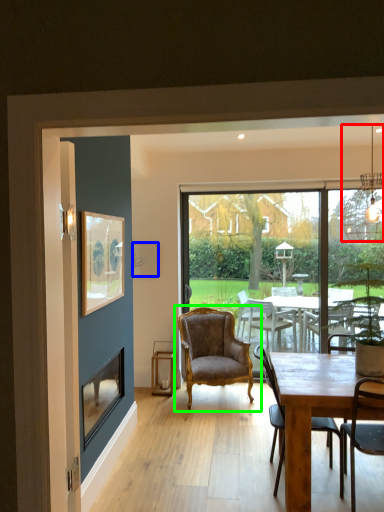
Question: Based on their relative distances, which object is farther from lamp (highlighted by a red box)? Choose from picture frame (highlighted by a blue box) and chair (highlighted by a green box).

Choices:
 (A) picture frame
 (B) chair

Answer: (A)